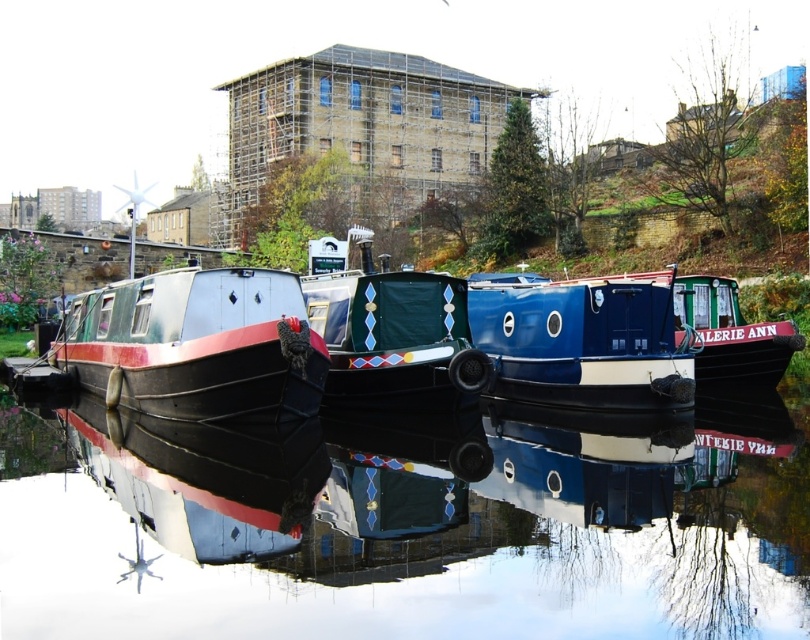
Question: Is matte blue and white boat at center bigger than green matte boat at center?

Choices:
 (A) no
 (B) yes

Answer: (B)

Question: Where is matte black boat at left located in relation to blue glossy boat at center in the image?

Choices:
 (A) below
 (B) above

Answer: (A)

Question: Does matte black boat at left come in front of blue glossy boat at center?

Choices:
 (A) yes
 (B) no

Answer: (A)

Question: Which point is farther from the camera taking this photo?

Choices:
 (A) (18, 554)
 (B) (625, 307)
 (C) (175, 301)
 (D) (714, 381)

Answer: (D)

Question: Which point is farther to the camera?

Choices:
 (A) matte blue and white boat at center
 (B) blue glossy boat at center
 (C) glossy black water at center

Answer: (B)

Question: Which of the following is the closest to the observer?

Choices:
 (A) (518, 444)
 (B) (369, 316)

Answer: (A)